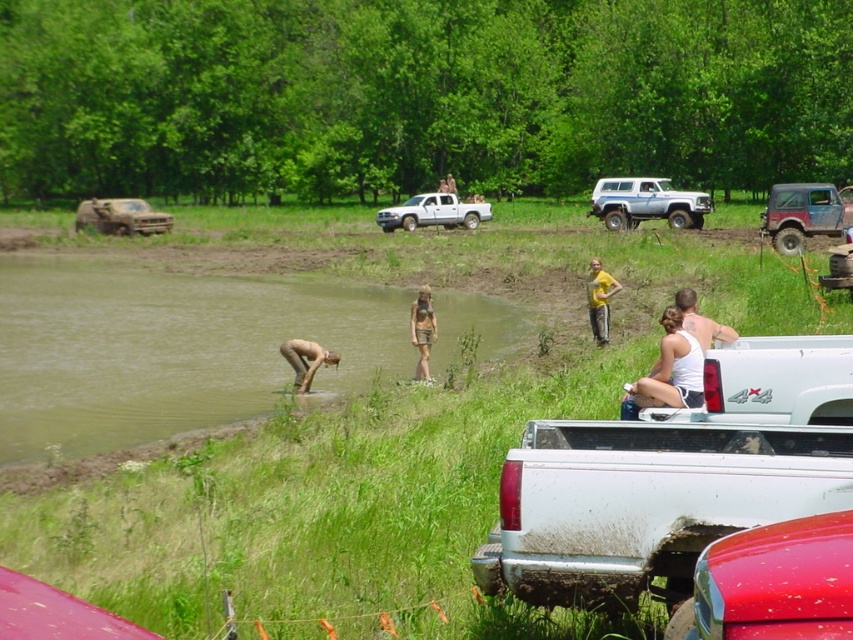
You are standing near the vehicles and want to take a photo of the brushed metal truck at left and the smooth skin person at lower center. Which object is closer to you, making it appear larger in the photo?

The brushed metal truck at left is closer to you than the smooth skin person at lower center, so it will appear larger in the photo.

You are standing at the origin point of the coordinate system in this scene. There is a silver metallic suv at upper center. Where is the point located at coordinate (646, 204) in relation to the silver metallic suv at upper center?

The point at coordinate (646, 204) corresponds to the silver metallic suv at upper center.